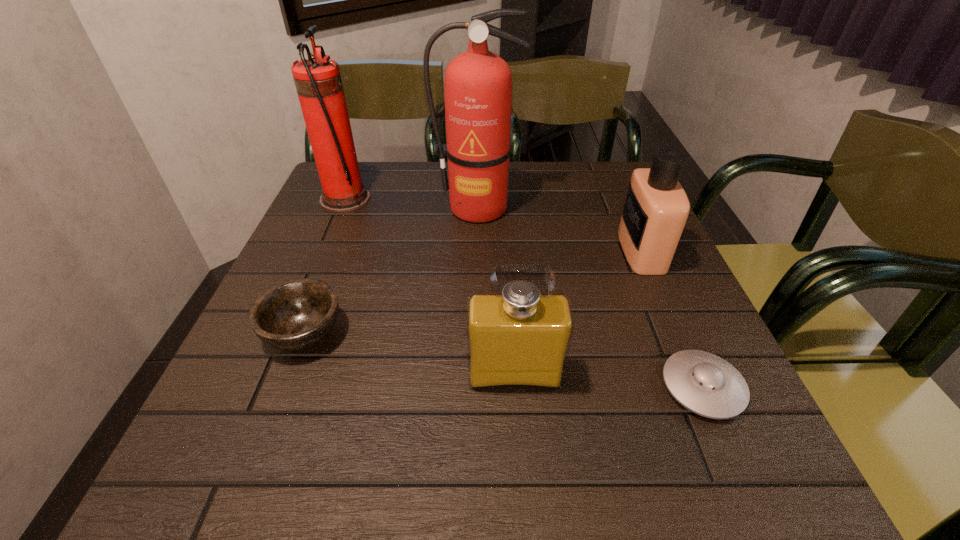
Identify the location of free space between the right fire extinguisher and the bowl. This screenshot has width=960, height=540. (391, 271).

Identify which object is the third nearest to the right fire extinguisher. Please provide its 2D coordinates. Your answer should be formatted as a tuple, i.e. [(x, y)], where the tuple contains the x and y coordinates of a point satisfying the conditions above.

[(297, 314)]

The height and width of the screenshot is (540, 960). Find the location of `object that is the second closest to the right fire extinguisher`. object that is the second closest to the right fire extinguisher is located at coordinates (656, 208).

Image resolution: width=960 pixels, height=540 pixels. Find the location of `vacant space that satisfies the following two spatial constraints: 1. on the front label of the farther perfume; 2. on the right side of the shortest object`. vacant space that satisfies the following two spatial constraints: 1. on the front label of the farther perfume; 2. on the right side of the shortest object is located at coordinates 701,387.

Identify the location of blank area in the image that satisfies the following two spatial constraints: 1. on the front-facing side of the shortest object; 2. on the left side of the left perfume. (516, 387).

Identify the location of vacant position in the image that satisfies the following two spatial constraints: 1. at the discharge end of the fifth tallest object; 2. on the right side of the left fire extinguisher. click(289, 333).

This screenshot has width=960, height=540. I want to click on vacant space that satisfies the following two spatial constraints: 1. on the side of the right fire extinguisher with the nozzle and handle; 2. on the left side of the saucer, so click(x=475, y=387).

You are a GUI agent. You are given a task and a screenshot of the screen. Output one action in this format:
    pyautogui.click(x=<x>, y=<y>)
    Task: Click on the vacant point that satisfies the following two spatial constraints: 1. on the side of the right fire extinguisher with the nozzle and handle; 2. on the right side of the saucer
    Image resolution: width=960 pixels, height=540 pixels.
    Given the screenshot: What is the action you would take?
    pyautogui.click(x=475, y=387)

Identify the location of vacant region that satisfies the following two spatial constraints: 1. on the front label of the right perfume; 2. on the front side of the bowl. The height and width of the screenshot is (540, 960). (677, 333).